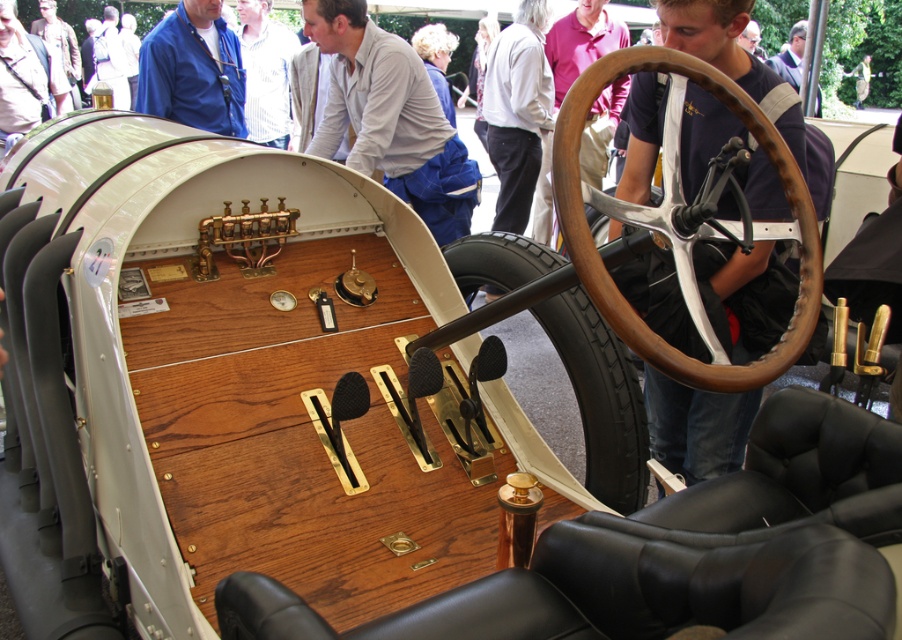
You are a tailor examining two shirts displayed in a vintage car. The shirts are the white cotton shirt at upper center and the striped cotton shirt at upper center. Which shirt has a wider width?

The striped cotton shirt at upper center is wider than the white cotton shirt at upper center.

You are a passenger in the vintage car and notice two shirts hanging on the back of the front seat. The shirts are the white cotton shirt at upper center and the striped cotton shirt at upper center. Which shirt is positioned higher?

The white cotton shirt at upper center is positioned higher since it is much taller than the striped cotton shirt at upper center.

You are a passenger in the vintage car and notice two items inside the car. One is the black rubber tire at center and the other is the white cotton shirt at upper center. Which item is positioned higher from the ground?

The white cotton shirt at upper center is positioned higher from the ground than the black rubber tire at center, as the tire is located below the shirt.